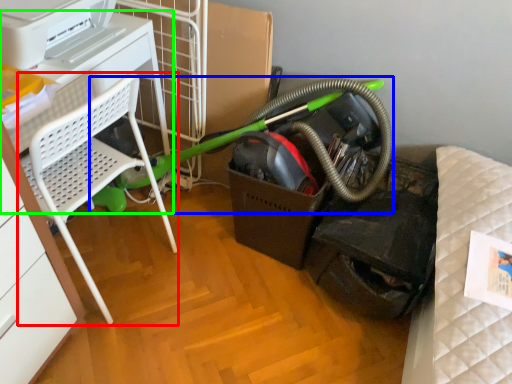
Question: Considering the real-world distances, which object is farthest from furniture (highlighted by a red box)? garden hose (highlighted by a blue box) or table (highlighted by a green box)?

Choices:
 (A) garden hose
 (B) table

Answer: (A)